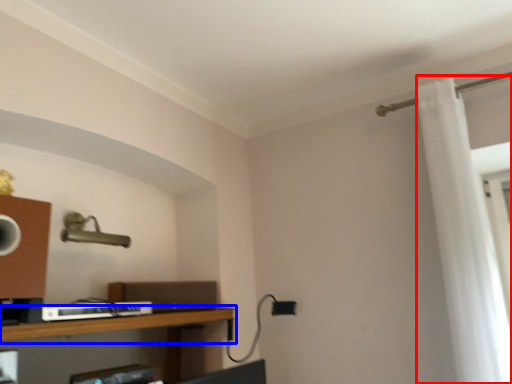
Question: Which object appears farthest to the camera in this image, shower curtain (highlighted by a red box) or shelf (highlighted by a blue box)?

Choices:
 (A) shower curtain
 (B) shelf

Answer: (A)